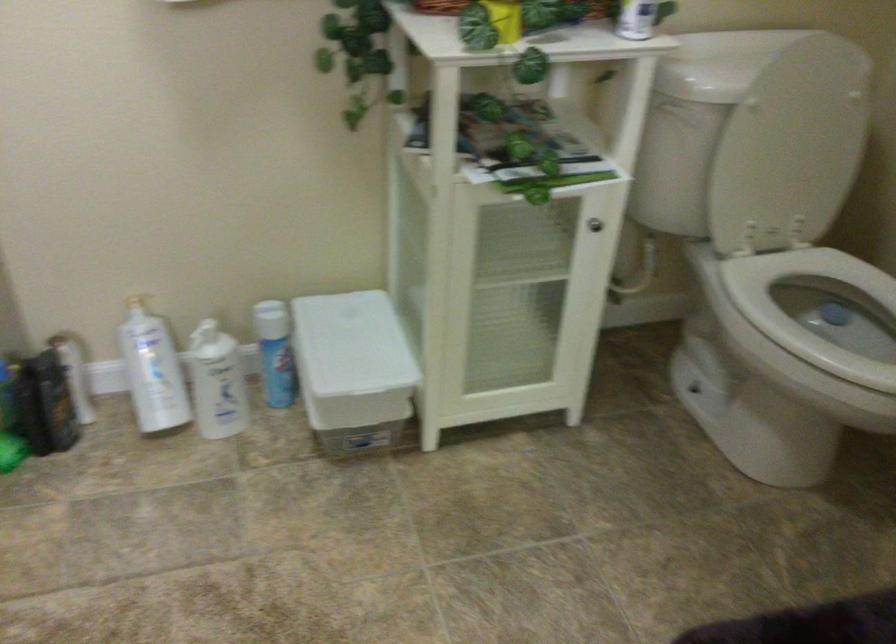
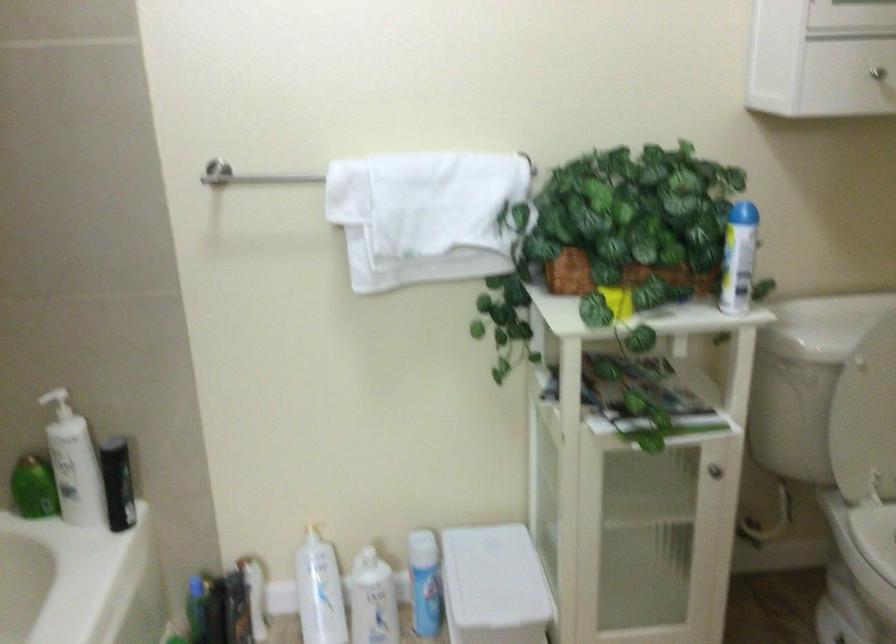
The point at (277, 355) is marked in the first image. Where is the corresponding point in the second image?

(424, 583)